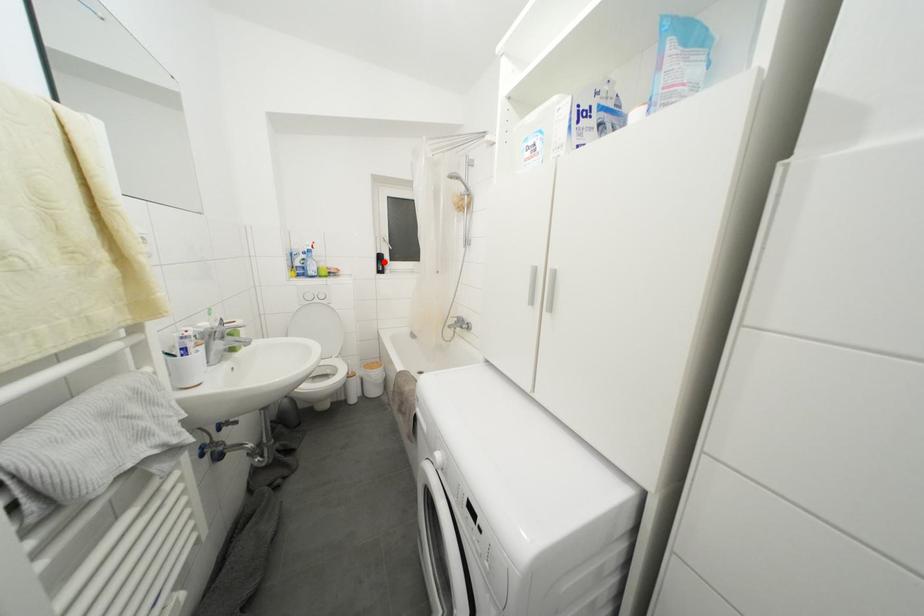
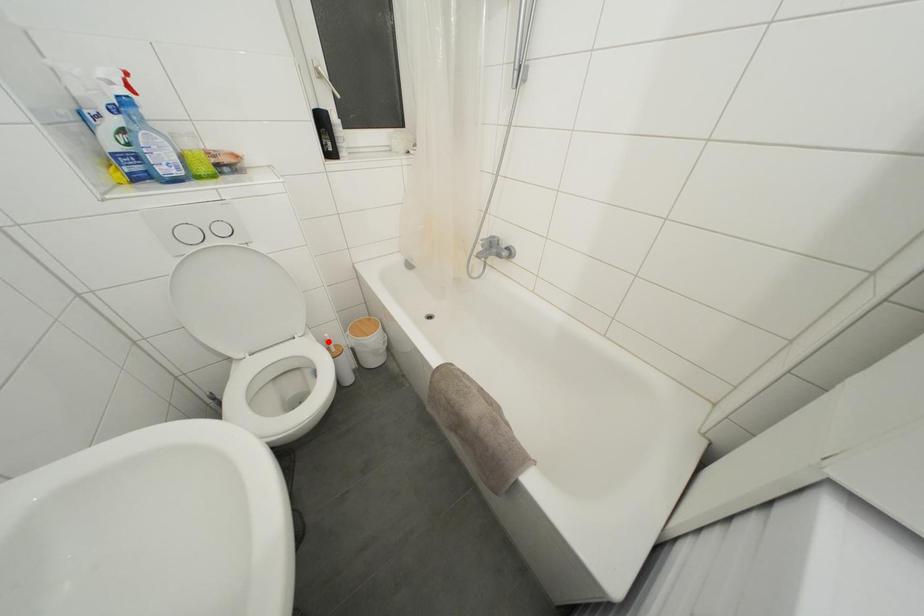
I am providing you with two images of the same scene from different viewpoints. A red point is marked on the first image and another point is marked on the second image. Do the highlighted points in image1 and image2 indicate the same real-world spot?

No